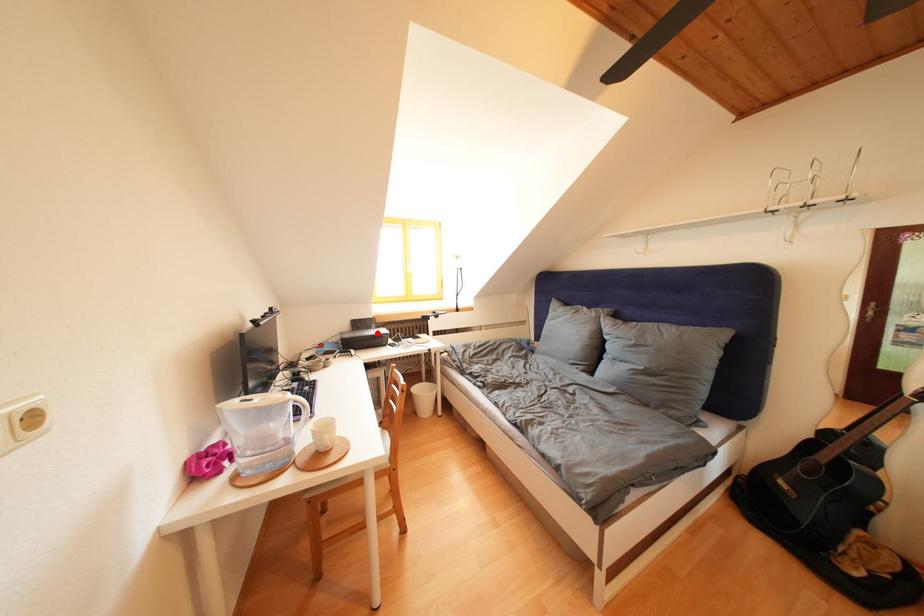
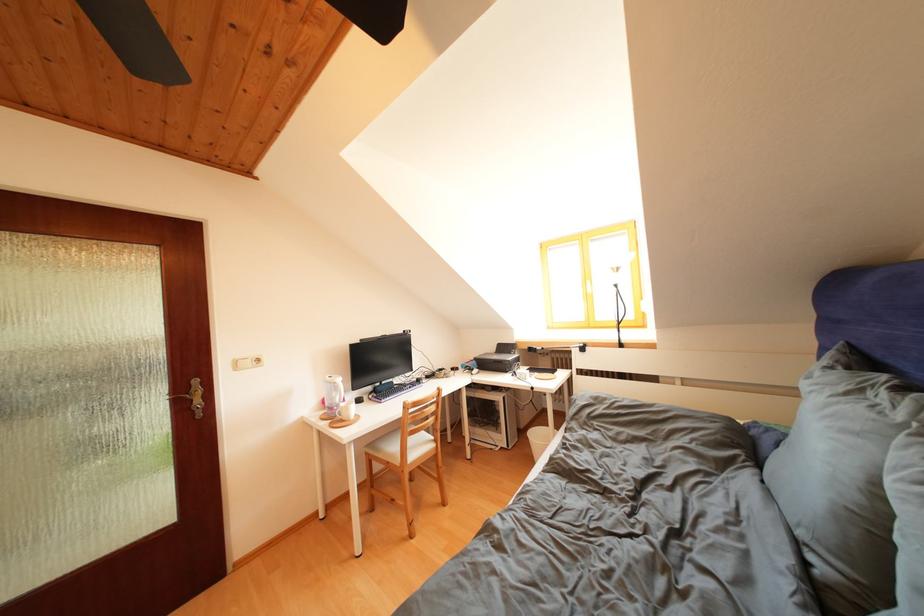
Find the pixel in the second image that matches the highlighted location in the first image.

(517, 358)